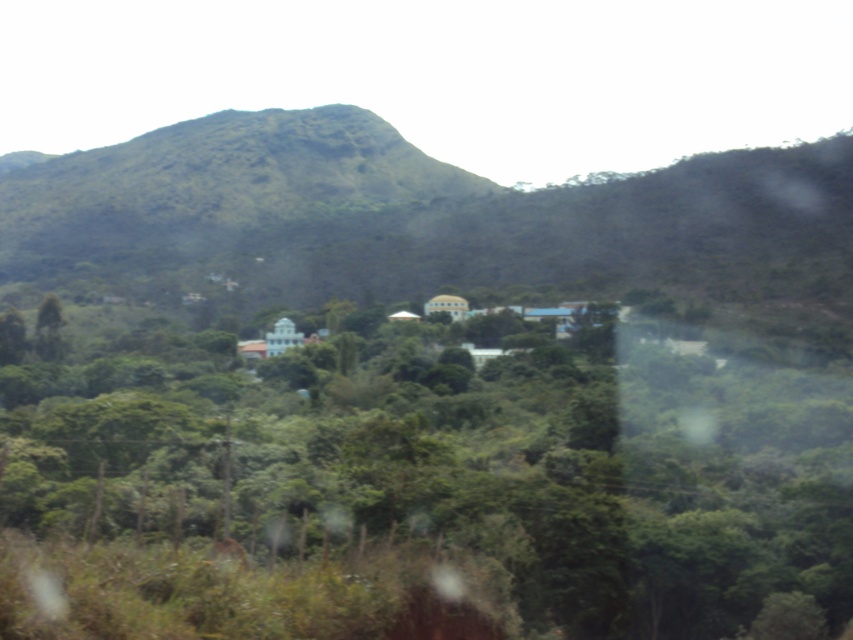
Does green leafy tree at center appear under green grassy mountain at center?

Correct, green leafy tree at center is located below green grassy mountain at center.

Is green leafy tree at center to the right of green grassy mountain at center from the viewer's perspective?

Yes, green leafy tree at center is to the right of green grassy mountain at center.

Is point (199, 337) behind point (785, 237)?

That is False.

Find the location of a particular element. This screenshot has width=853, height=640. green leafy tree at center is located at coordinates (416, 483).